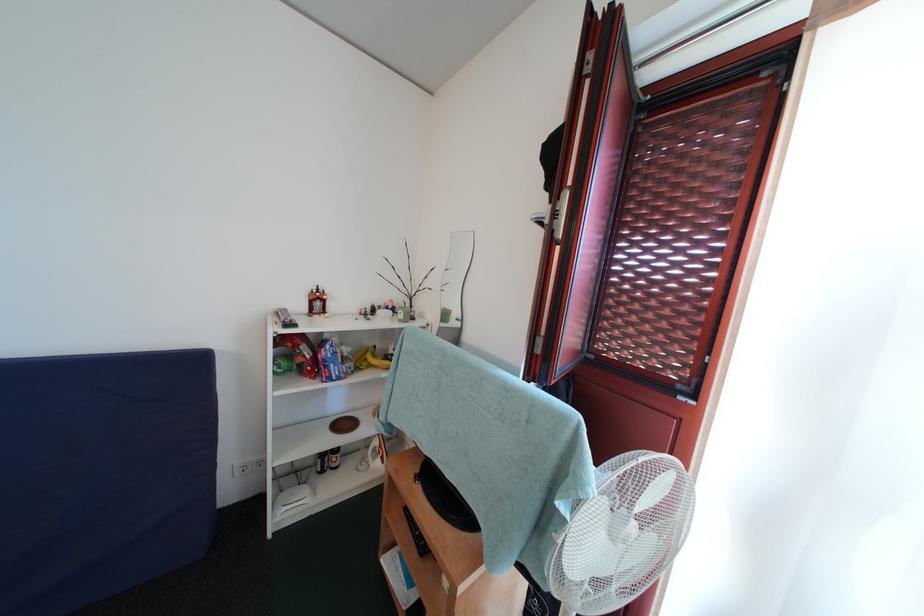
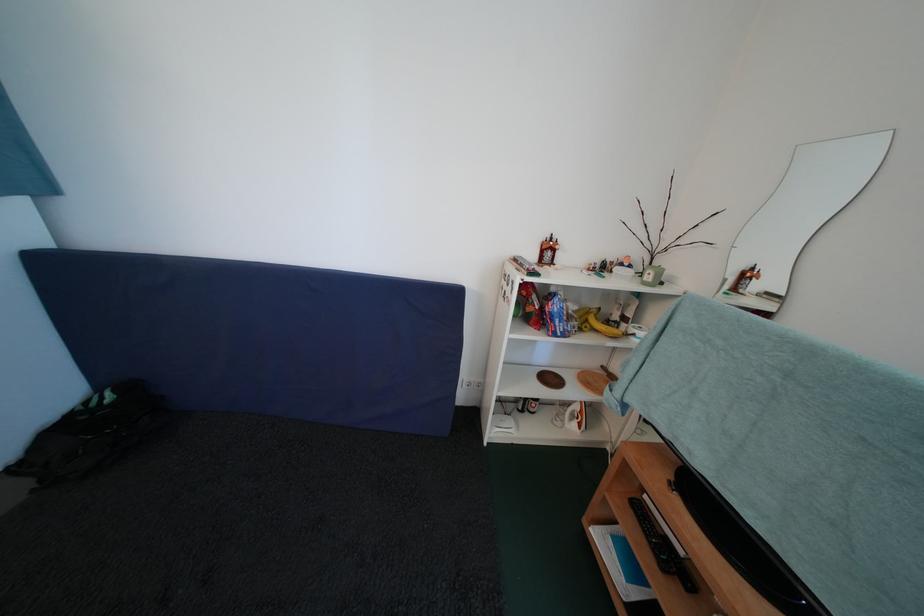
Where in the second image is the point corresponding to the point at 383,448 from the first image?

(584, 411)